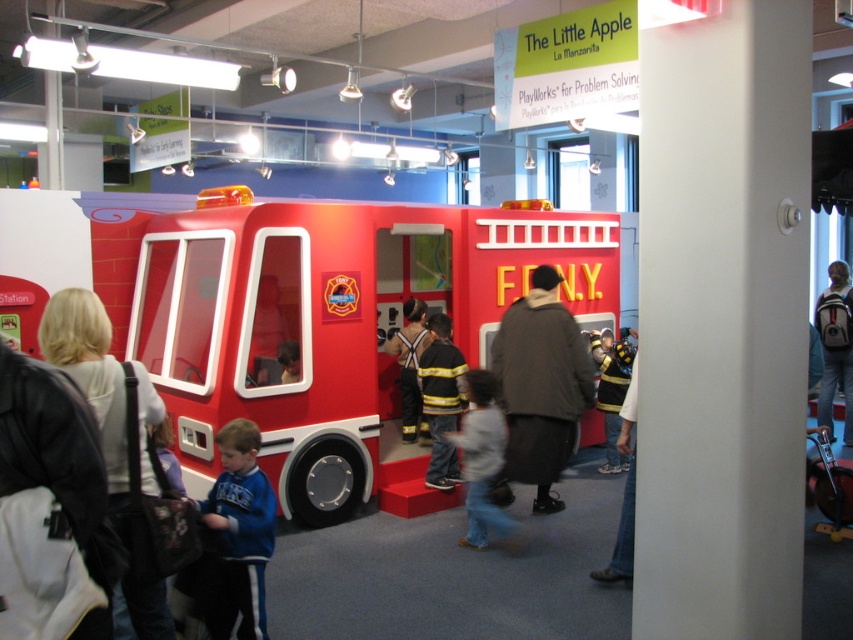
Question: Is shiny plastic fire truck at center above blue fleece jacket at lower left?

Choices:
 (A) no
 (B) yes

Answer: (B)

Question: Is dark brown coat at center smaller than yellow/black striped uniform at center?

Choices:
 (A) no
 (B) yes

Answer: (A)

Question: Which point appears closest to the camera in this image?

Choices:
 (A) (296, 246)
 (B) (836, 296)

Answer: (A)

Question: Which object appears farthest from the camera in this image?

Choices:
 (A) gray backpack at right
 (B) firefighter uniform at center
 (C) light gray cotton shirt at center
 (D) yellow/black striped uniform at center

Answer: (A)

Question: Among these points, which one is farthest from the camera?

Choices:
 (A) (846, 364)
 (B) (476, 486)
 (C) (410, 298)

Answer: (A)

Question: Does shiny plastic fire truck at center appear on the right side of blue fleece jacket at lower left?

Choices:
 (A) no
 (B) yes

Answer: (B)